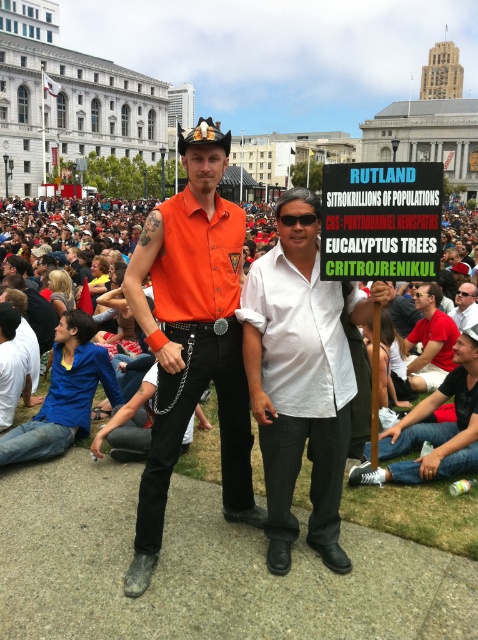
Question: Considering the relative positions of orange matte shirt at center and red shirt at center in the image provided, where is orange matte shirt at center located with respect to red shirt at center?

Choices:
 (A) above
 (B) below

Answer: (A)

Question: Considering the real-world distances, which object is farthest from the red shirt at center?

Choices:
 (A) matte white shirt at center
 (B) orange matte shirt at center
 (C) white matte shirt at center
 (D) matte orange shirt at center

Answer: (B)

Question: Which point is closer to the camera?

Choices:
 (A) (460, 301)
 (B) (45, 314)
 (C) (473, 397)

Answer: (C)

Question: Which point appears farthest from the camera in this image?

Choices:
 (A) (409, 460)
 (B) (427, 346)

Answer: (B)

Question: Considering the relative positions of orange matte shirt at center and red shirt at center in the image provided, where is orange matte shirt at center located with respect to red shirt at center?

Choices:
 (A) above
 (B) below

Answer: (A)

Question: Can you confirm if white matte shirt at center is wider than red shirt at center?

Choices:
 (A) no
 (B) yes

Answer: (B)